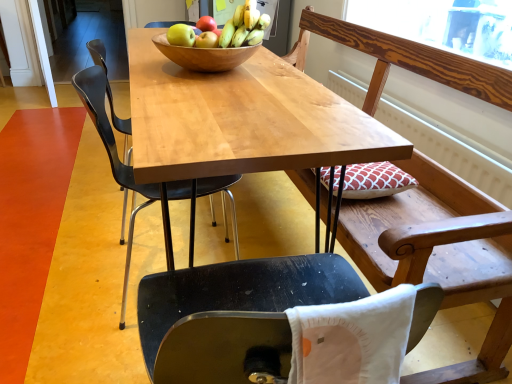
Question: Considering the relative sizes of wooden bowl at center and matte yellow apple at center, which is the third apple from back to front, in the image provided, is wooden bowl at center shorter than matte yellow apple at center, which is the third apple from back to front,?

Choices:
 (A) yes
 (B) no

Answer: (B)

Question: Is wooden bowl at center outside of matte yellow apple at center, which is the third apple from back to front?

Choices:
 (A) yes
 (B) no

Answer: (A)

Question: Is wooden bowl at center not near matte yellow apple at center, the 1th apple viewed from the front?

Choices:
 (A) yes
 (B) no

Answer: (B)

Question: Can you confirm if wooden bowl at center is taller than matte yellow apple at center, the 1th apple viewed from the front?

Choices:
 (A) no
 (B) yes

Answer: (B)

Question: Can you confirm if wooden bowl at center is positioned to the right of matte yellow apple at center, which is the third apple from back to front?

Choices:
 (A) no
 (B) yes

Answer: (B)

Question: Based on their sizes in the image, would you say yellow matte bananas at center is bigger or smaller than wooden bench at upper right?

Choices:
 (A) big
 (B) small

Answer: (B)

Question: Is yellow matte bananas at center inside or outside of wooden bench at upper right?

Choices:
 (A) inside
 (B) outside

Answer: (B)

Question: Is yellow matte bananas at center to the left or to the right of wooden bench at upper right in the image?

Choices:
 (A) right
 (B) left

Answer: (B)

Question: Is yellow matte bananas at center in front of or behind wooden bench at upper right in the image?

Choices:
 (A) behind
 (B) front

Answer: (A)

Question: From a real-world perspective, is matte red apple at center, which is the 1th apple from back to front, above or below matte yellow apple at center, the 1th apple viewed from the front?

Choices:
 (A) above
 (B) below

Answer: (A)

Question: Would you say matte red apple at center, the third apple viewed from the front, is inside or outside matte yellow apple at center, which is the third apple from back to front?

Choices:
 (A) outside
 (B) inside

Answer: (A)

Question: Looking at their shapes, would you say matte red apple at center, the third apple viewed from the front, is wider or thinner than matte yellow apple at center, which is the third apple from back to front?

Choices:
 (A) wide
 (B) thin

Answer: (B)

Question: From the image's perspective, relative to matte yellow apple at center, the 1th apple viewed from the front, is matte red apple at center, the third apple viewed from the front, above or below?

Choices:
 (A) above
 (B) below

Answer: (A)

Question: Would you say white fabric pillow at lower center is inside or outside wooden bench at upper right?

Choices:
 (A) inside
 (B) outside

Answer: (B)

Question: From the image's perspective, is white fabric pillow at lower center positioned above or below wooden bench at upper right?

Choices:
 (A) below
 (B) above

Answer: (A)